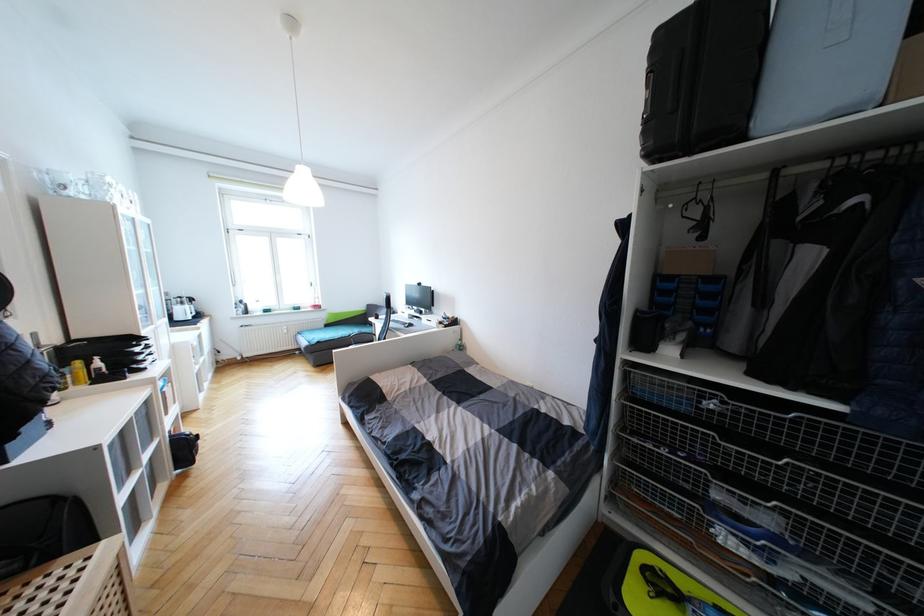
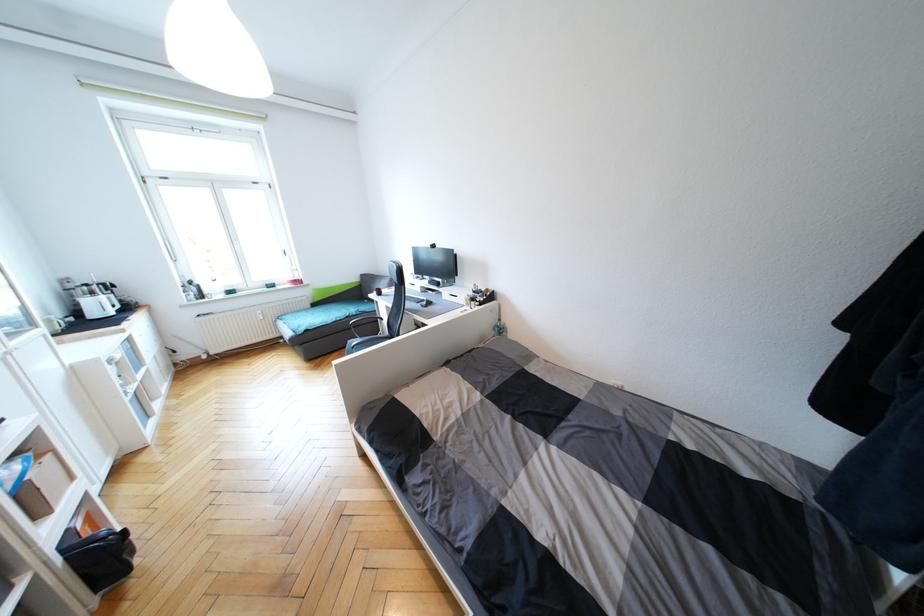
Which direction would the cameraman need to move to produce the second image?

The cameraman moved toward left, forward.